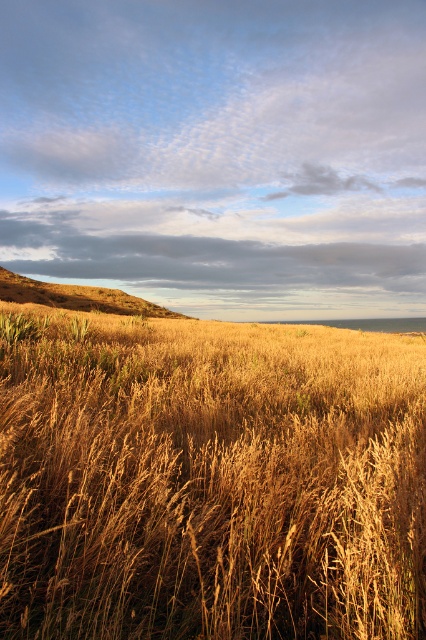
Question: Which point appears farthest from the camera in this image?

Choices:
 (A) [23, 349]
 (B) [55, 298]

Answer: (B)

Question: Can you confirm if golden dry grass at center is positioned below golden grassy hillside at upper left?

Choices:
 (A) yes
 (B) no

Answer: (A)

Question: Is golden dry grass at center bigger than golden grassy hillside at upper left?

Choices:
 (A) no
 (B) yes

Answer: (A)

Question: Which object appears closest to the camera in this image?

Choices:
 (A) golden grassy hillside at upper left
 (B) golden dry grass at center

Answer: (B)

Question: Is golden dry grass at center thinner than golden grassy hillside at upper left?

Choices:
 (A) yes
 (B) no

Answer: (A)